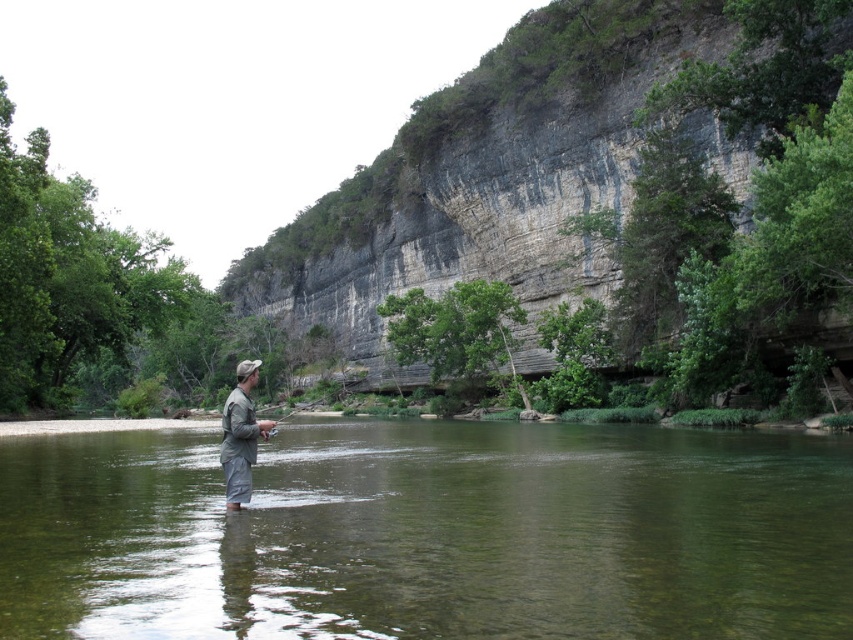
Question: Is clear water at center above gray matte waders at center?

Choices:
 (A) yes
 (B) no

Answer: (A)

Question: Is gray rock cliff at center bigger than gray matte waders at center?

Choices:
 (A) no
 (B) yes

Answer: (B)

Question: Is gray rock cliff at center above gray matte waders at center?

Choices:
 (A) yes
 (B) no

Answer: (A)

Question: Which point appears farthest from the camera in this image?

Choices:
 (A) (544, 452)
 (B) (238, 492)
 (C) (483, 65)

Answer: (C)

Question: Which point is closer to the camera?

Choices:
 (A) clear water at center
 (B) gray matte waders at center
 (C) gray rock cliff at center

Answer: (A)

Question: Among these points, which one is farthest from the camera?

Choices:
 (A) (480, 442)
 (B) (479, 131)

Answer: (B)